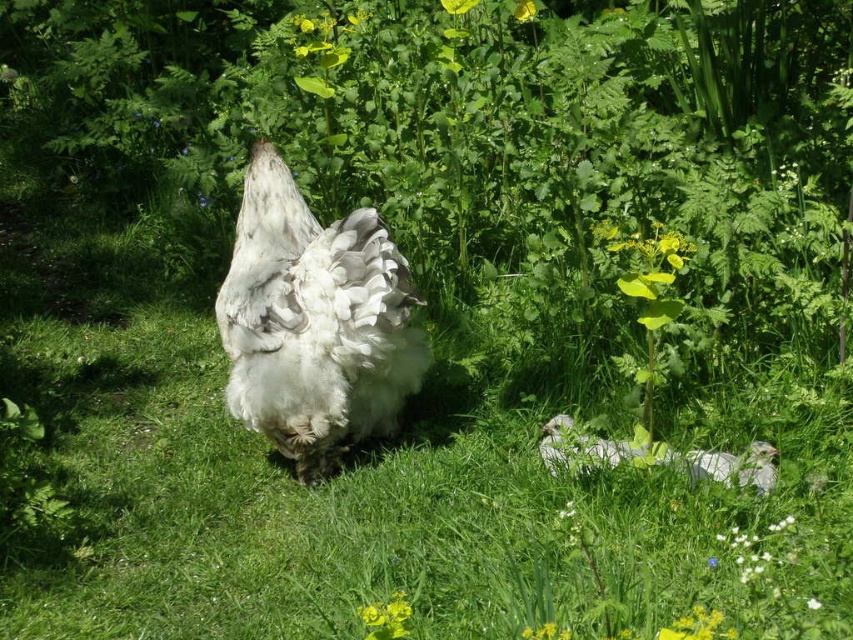
Who is shorter, white fluffy chicken at center or white fluffy chicken at lower center?

white fluffy chicken at lower center is shorter.

Is white fluffy chicken at center smaller than white fluffy chicken at lower center?

No, white fluffy chicken at center is not smaller than white fluffy chicken at lower center.

Image resolution: width=853 pixels, height=640 pixels. Describe the element at coordinates (314, 323) in the screenshot. I see `white fluffy chicken at center` at that location.

This screenshot has width=853, height=640. I want to click on white fluffy chicken at center, so (314, 323).